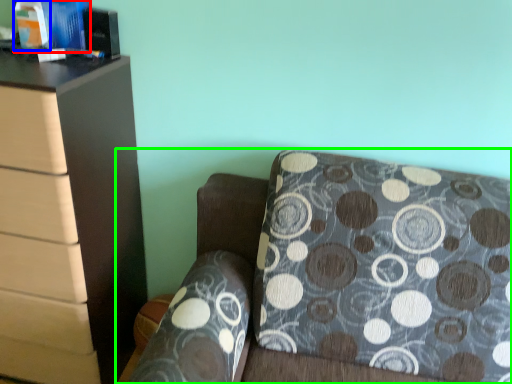
Question: Which object is positioned farthest from book (highlighted by a red box)? Select from book (highlighted by a blue box) and furniture (highlighted by a green box).

Choices:
 (A) book
 (B) furniture

Answer: (B)